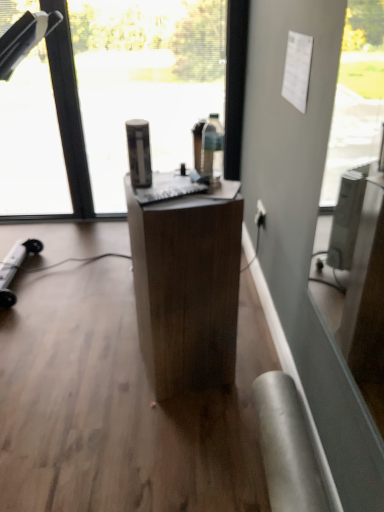
At what (x,y) coordinates should I click in order to perform the action: click on space that is in front of wooden desk at center. Please return your answer as a coordinate pair (x, y). Looking at the image, I should click on (177, 428).